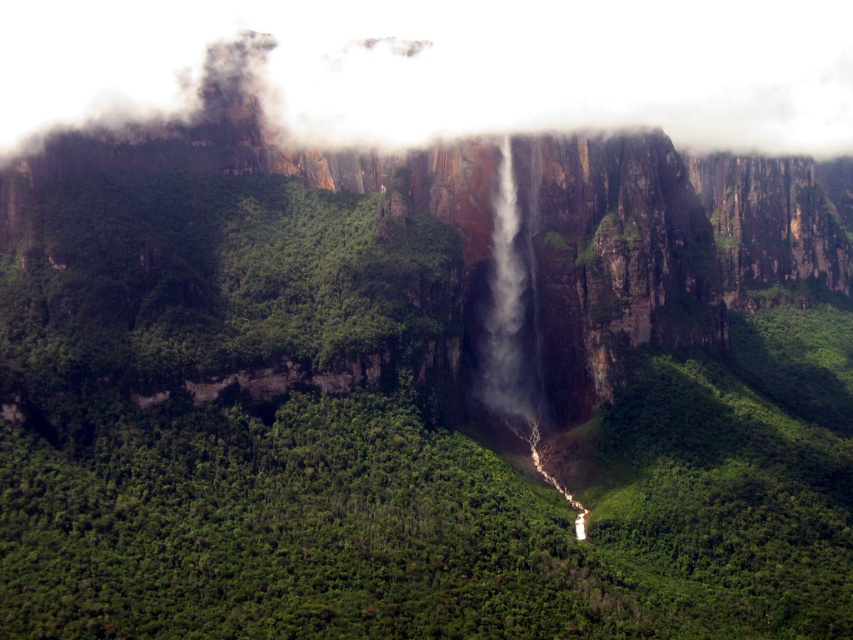
You are a drone operator tasked with capturing aerial footage of the waterfall. Your drone has a maximum flight range of 300 meters. If you are currently at the camera position, can your drone reach the white fog at upper center?

The white fog at upper center is 319.59 meters away from camera, which exceeds the drone maximum flight range of 300 meters. Therefore, the drone cannot reach the white fog at upper center.

You are standing at the base of the waterfall and looking up at the cliff face. There are two points marked on the cliff wall. One is at coordinate point (474, 17) and the other is at point (502, 154). Which point is closer to your current position?

Point (474, 17) is further to the camera than point (502, 154), so the point closer to your position is point (502, 154).